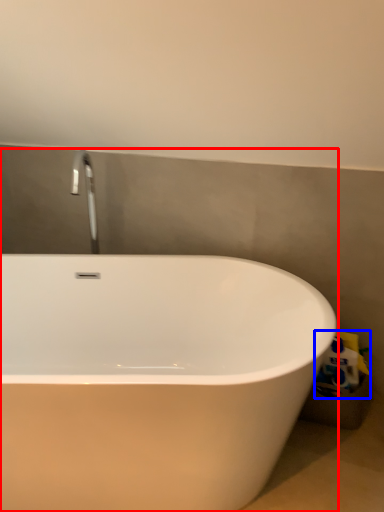
Question: Which of the following is the closest to the observer, bathtub (highlighted by a red box) or toilet paper (highlighted by a blue box)?

Choices:
 (A) bathtub
 (B) toilet paper

Answer: (A)